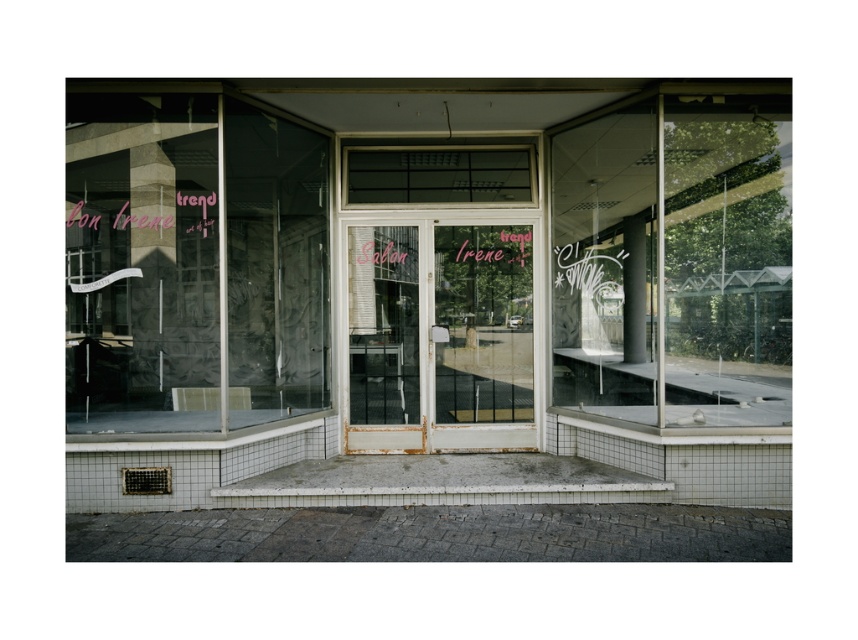
Question: Among these objects, which one is nearest to the camera?

Choices:
 (A) transparent glass window at center
 (B) transparent glass at left
 (C) rusty metal screen door at center
 (D) transparent glass storefront at center

Answer: (B)

Question: Which is farther from the transparent glass window at center?

Choices:
 (A) transparent glass at left
 (B) transparent glass storefront at center
 (C) white painted wood screen door at center

Answer: (B)

Question: Can you confirm if transparent glass storefront at center is wider than white painted wood screen door at center?

Choices:
 (A) no
 (B) yes

Answer: (A)

Question: Which point is closer to the camera taking this photo?

Choices:
 (A) (417, 280)
 (B) (462, 362)
 (C) (263, 182)
 (D) (581, 288)

Answer: (D)

Question: Can you confirm if transparent glass storefront at center is positioned to the left of rusty metal screen door at center?

Choices:
 (A) yes
 (B) no

Answer: (A)

Question: Observing the image, what is the correct spatial positioning of transparent glass storefront at center in reference to white painted wood screen door at center?

Choices:
 (A) right
 (B) left

Answer: (B)